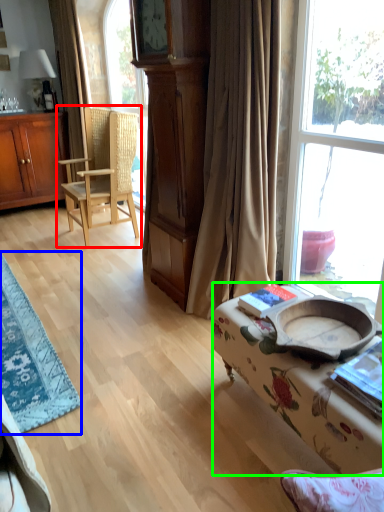
Question: Which object is the closest to the chair (highlighted by a red box)? Choose among these: table (highlighted by a blue box) or studio couch (highlighted by a green box).

Choices:
 (A) table
 (B) studio couch

Answer: (A)